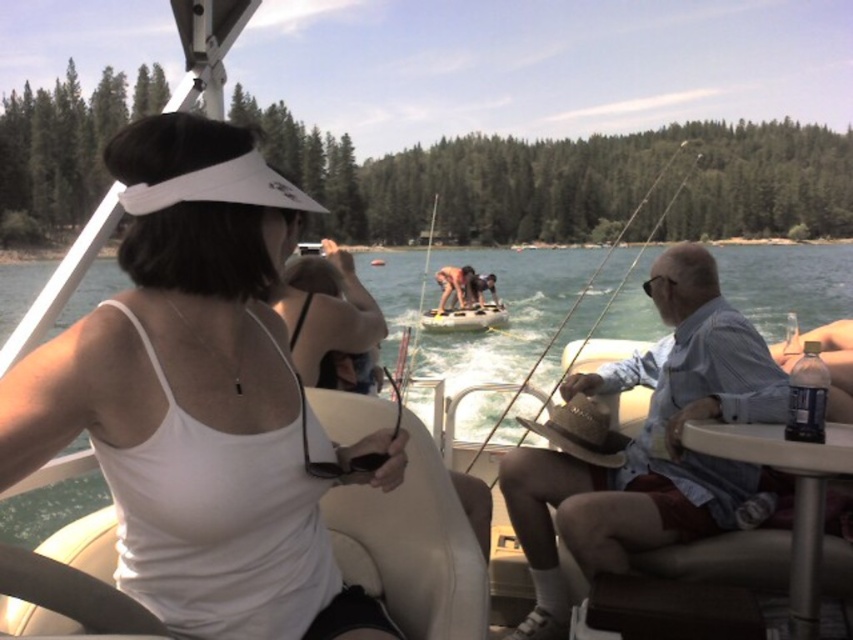
Does light blue denim shirt at right have a greater height compared to rubber dinghy at center?

Yes.

Between point (663, 376) and point (442, 317), which one is positioned behind?

The point (442, 317) is more distant.

Who is more distant from viewer, (636,496) or (498,323)?

The point (498,323) is behind.

Identify the location of light blue denim shirt at right. (648, 444).

Is white matte visor at upper left positioned in front of rubber dinghy at center?

That is True.

Does white matte visor at upper left appear on the right side of rubber dinghy at center?

No, white matte visor at upper left is not to the right of rubber dinghy at center.

Who is more distant from viewer, (115, 435) or (450, 316)?

Positioned behind is point (450, 316).

In order to click on white matte visor at upper left in this screenshot , I will do `click(193, 403)`.

Does point (201, 298) lie in front of point (686, 509)?

Yes, point (201, 298) is closer to viewer.

Between white matte visor at upper left and light blue denim shirt at right, which one has more height?

Standing taller between the two is light blue denim shirt at right.

This screenshot has width=853, height=640. I want to click on white matte visor at upper left, so click(x=193, y=403).